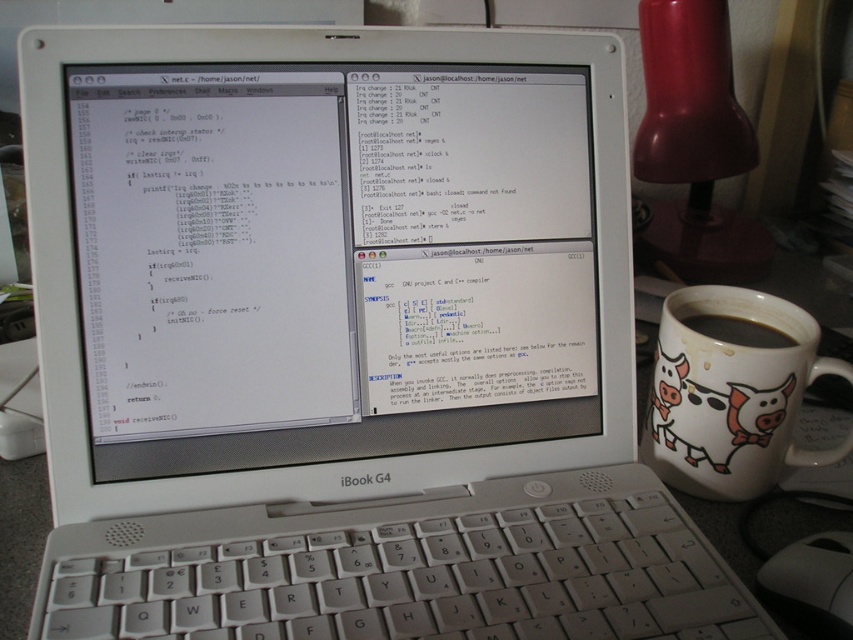
Is white ceramic mug at right wider than white plastic mouse at lower right?

Correct, the width of white ceramic mug at right exceeds that of white plastic mouse at lower right.

Does point (717, 436) come in front of point (773, 608)?

No, it is behind (773, 608).

Does point (654, 460) lie behind point (790, 572)?

Yes, point (654, 460) is behind point (790, 572).

This screenshot has width=853, height=640. I want to click on white ceramic mug at right, so click(730, 396).

Measure the distance from white plastic mouse at lower right to black matte mug at right.

The distance of white plastic mouse at lower right from black matte mug at right is 5.49 inches.

Image resolution: width=853 pixels, height=640 pixels. I want to click on white plastic mouse at lower right, so click(x=811, y=582).

How far apart are white glossy computer screen at center and white plastic mouse at lower right?

white glossy computer screen at center and white plastic mouse at lower right are 11.08 inches apart.

Is white glossy computer screen at center thinner than white plastic mouse at lower right?

Incorrect, white glossy computer screen at center's width is not less than white plastic mouse at lower right's.

Who is more distant from viewer, (207, 374) or (845, 625)?

The point (207, 374) is behind.

Find the location of a particular element. The height and width of the screenshot is (640, 853). white glossy computer screen at center is located at coordinates (329, 260).